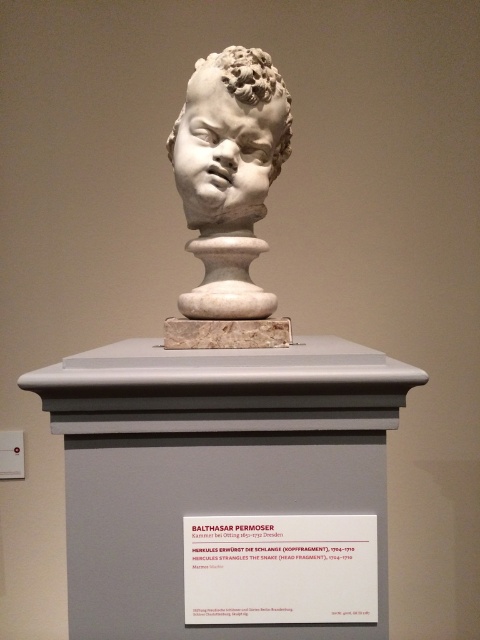
Question: Which point is farther to the camera?

Choices:
 (A) white marble head at center
 (B) white marble bust at center

Answer: (A)

Question: Is white marble bust at center positioned before white marble head at center?

Choices:
 (A) no
 (B) yes

Answer: (B)

Question: From the image, what is the correct spatial relationship of white marble bust at center in relation to white marble head at center?

Choices:
 (A) below
 (B) above

Answer: (A)

Question: Which point is farther to the camera?

Choices:
 (A) (277, 92)
 (B) (254, 61)

Answer: (A)

Question: Does white marble bust at center lie behind white marble head at center?

Choices:
 (A) no
 (B) yes

Answer: (A)